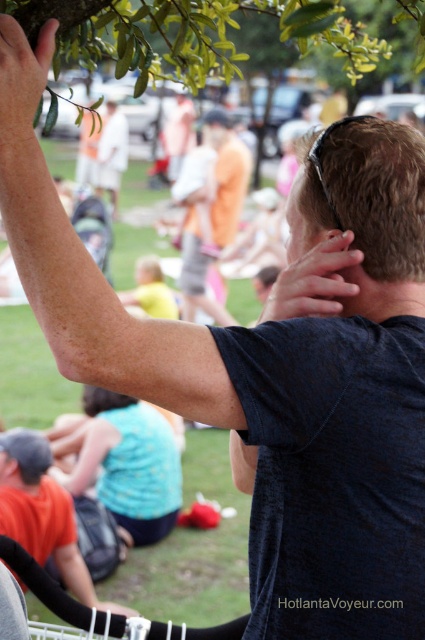
Looking at this image, between orange cotton shorts at center and matte black hand at upper center, which one has more height?

orange cotton shorts at center

The width and height of the screenshot is (425, 640). What are the coordinates of `orange cotton shorts at center` in the screenshot? It's located at (209, 209).

Is point (207, 168) closer to viewer compared to point (263, 307)?

No, (207, 168) is behind (263, 307).

Where is `orange cotton shorts at center`? orange cotton shorts at center is located at coordinates (209, 209).

Between green leafy branch at upper center and matte black shirt at center, which one is positioned higher?

matte black shirt at center

Does green leafy branch at upper center have a lesser height compared to matte black shirt at center?

Correct, green leafy branch at upper center is not as tall as matte black shirt at center.

Image resolution: width=425 pixels, height=640 pixels. Identify the location of green leafy branch at upper center. [187, 35].

Where is `green leafy branch at upper center`? green leafy branch at upper center is located at coordinates (187, 35).

Does point (336, 269) come closer to viewer compared to point (2, 96)?

No, it is not.

Identify the location of matte black hand at upper center. Image resolution: width=425 pixels, height=640 pixels. (314, 282).